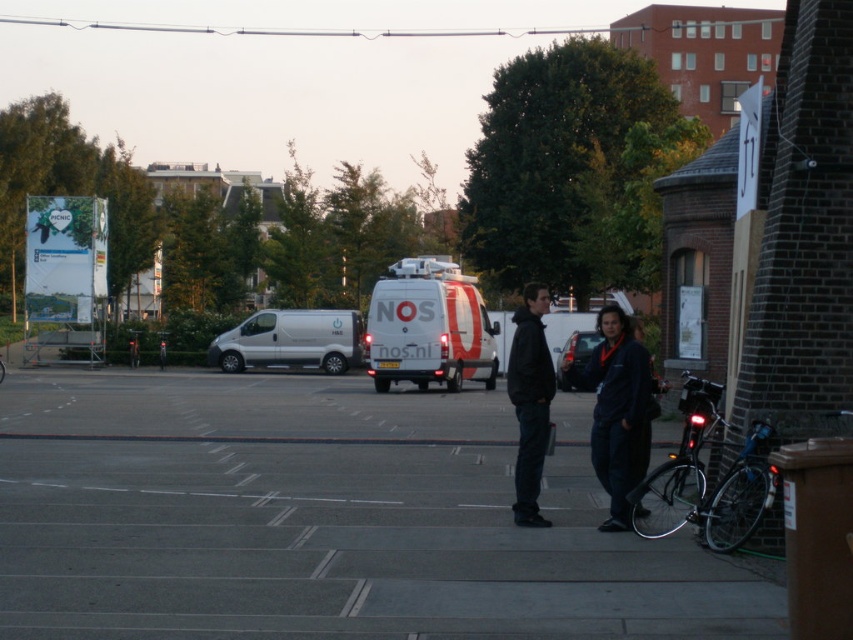
Based on the scene description, where is the silver metallic van at center located in terms of coordinates?

The silver metallic van at center is located at coordinates point (291, 340).

You are a delivery person who needs to park your bike near the dark blue jacket at center. The white glossy van at center is blocking the path. Can you move around the van to reach the jacket?

The white glossy van at center is to the left of dark blue jacket at center, so you can move around the van on the right side to reach the jacket.

You are a delivery person trying to find a parking spot between the white glossy van at center and the dark blue jacket at center. Based on their positions, which object should you prioritize moving around to access the parking spot?

The white glossy van at center is located above the dark blue jacket at center, so you should prioritize moving around the dark blue jacket at center since it is lower and closer to the ground, making it easier to navigate around when accessing the parking spot.